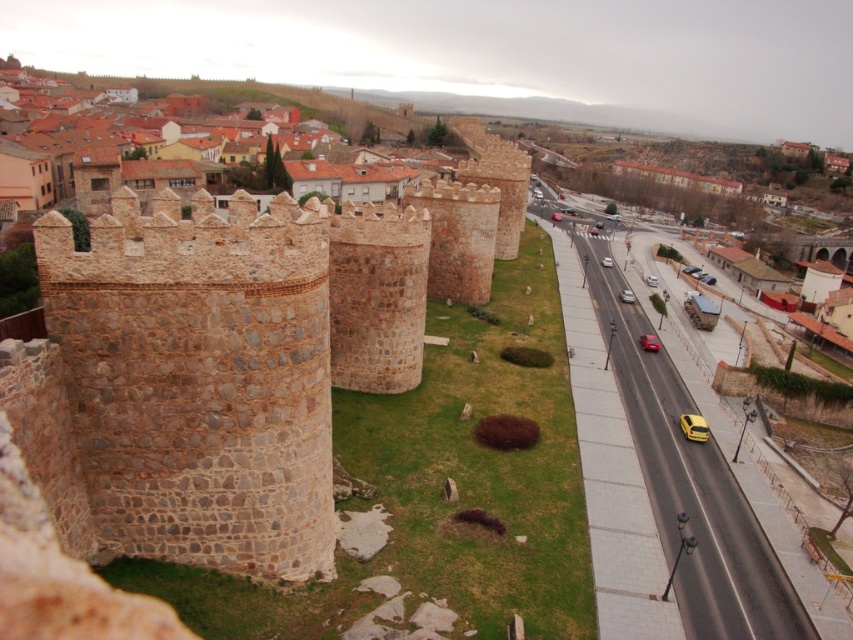
Is point (263, 371) positioned before point (650, 337)?

That is True.

Locate an element on the screen. brown stone castle at center is located at coordinates (235, 356).

The height and width of the screenshot is (640, 853). I want to click on brown stone castle at center, so click(235, 356).

At what (x,y) coordinates should I click in order to perform the action: click on brown stone castle at center. Please return your answer as a coordinate pair (x, y). The height and width of the screenshot is (640, 853). Looking at the image, I should click on (235, 356).

Is silver metallic sedan at center positioned before silver metallic car at center?

Yes, it is in front of silver metallic car at center.

Does silver metallic sedan at center have a lesser height compared to silver metallic car at center?

Yes, silver metallic sedan at center is shorter than silver metallic car at center.

Does point (631, 300) come farther from viewer compared to point (601, 260)?

No.

Find the location of a particular element. Image resolution: width=853 pixels, height=640 pixels. silver metallic sedan at center is located at coordinates (625, 296).

Does brown stone castle at center have a lesser height compared to silver metallic car at center?

Incorrect, brown stone castle at center's height does not fall short of silver metallic car at center's.

Which is behind, point (32, 440) or point (611, 259)?

The point (611, 259) is behind.

Does point (103, 376) lie in front of point (604, 257)?

Yes.

This screenshot has height=640, width=853. In order to click on brown stone castle at center in this screenshot , I will do `click(235, 356)`.